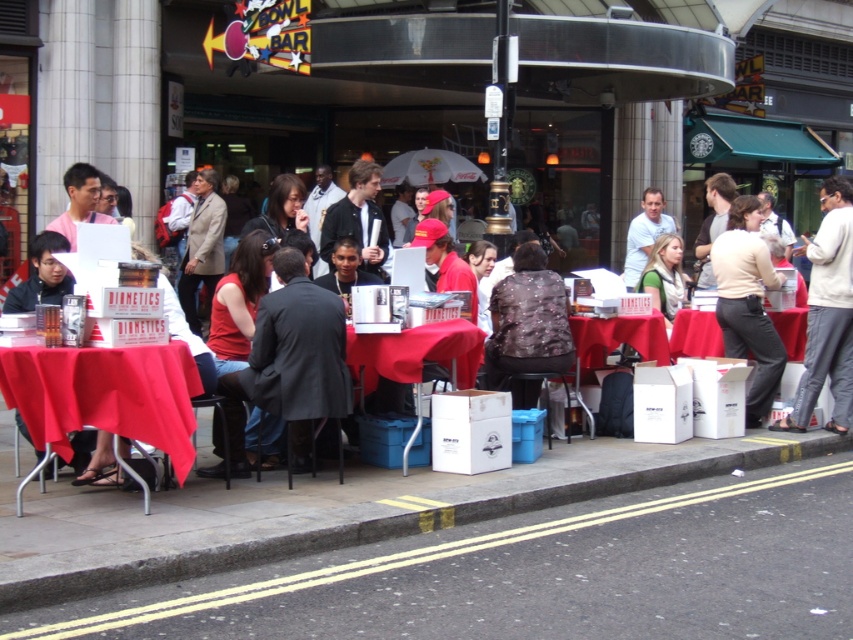
You are a delivery person who needs to place a new package on the table. The package is 28 inches wide. Can you fit it between the white cardboard box at lower center and the red fabric table at center without moving either?

The distance between the white cardboard box at lower center and the red fabric table at center is 27.46 inches. Since the package is 28 inches wide, it cannot fit in the space between them without moving either object.

You are a delivery person who needs to place a heavy package on the ground. The ground here is the smooth asphalt road at lower center and there is a white cardboard box at lower center in the way. Can you move the box to make space for your package?

The smooth asphalt road at lower center is below the white cardboard box at lower center, so you can move the white cardboard box at lower center to the side to create space on the smooth asphalt road at lower center for your package.

You are standing at the point labeled as point (537,573) in the image. What material are you standing on?

The point (537,573) corresponds to the smooth asphalt road at lower center, so you are standing on asphalt.